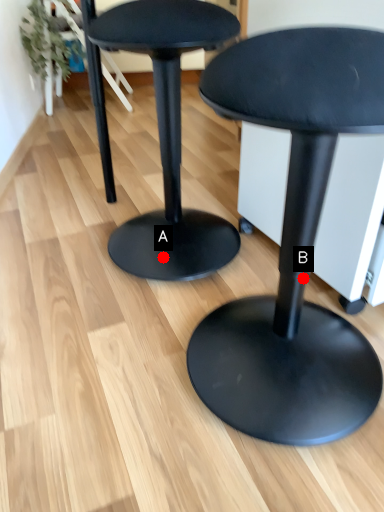
Question: Two points are circled on the image, labeled by A and B beside each circle. Among these points, which one is farthest from the camera?

Choices:
 (A) A is further
 (B) B is further

Answer: (A)